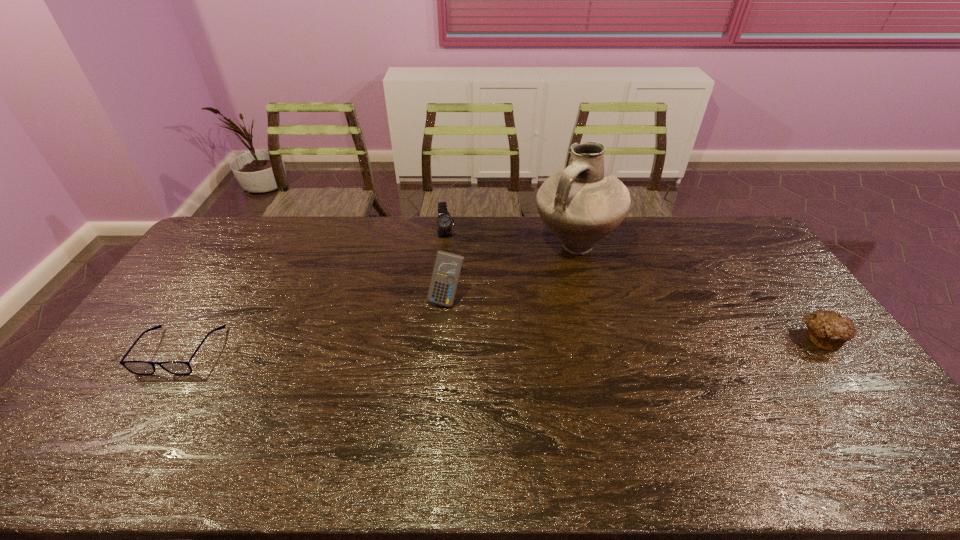
What are the coordinates of `free space located on the left of the muffin` in the screenshot? It's located at (702, 338).

This screenshot has width=960, height=540. In order to click on free space located 0.050m on the handle side of the pitcher in this screenshot , I will do `click(559, 280)`.

I want to click on free location located 0.070m on the handle side of the pitcher, so click(x=557, y=284).

Where is `vacant space situated 0.120m on the handle side of the pitcher`? vacant space situated 0.120m on the handle side of the pitcher is located at coordinates (552, 293).

At what (x,y) coordinates should I click in order to perform the action: click on vacant space situated on the face of the third tallest object. Please return your answer as a coordinate pair (x, y). Looking at the image, I should click on (458, 294).

Where is `vacant space located 0.120m on the face of the third tallest object`? Image resolution: width=960 pixels, height=540 pixels. vacant space located 0.120m on the face of the third tallest object is located at coordinates point(451,262).

Locate an element on the screen. The height and width of the screenshot is (540, 960). free space located 0.400m on the face of the third tallest object is located at coordinates (464, 319).

Identify the location of vacant area situated on the front-facing side of the fourth shortest object. The width and height of the screenshot is (960, 540). (396, 399).

This screenshot has width=960, height=540. I want to click on vacant region located 0.140m on the front-facing side of the fourth shortest object, so click(424, 342).

What are the coordinates of `free space located 0.240m on the front-facing side of the fourth shortest object` in the screenshot? It's located at (412, 369).